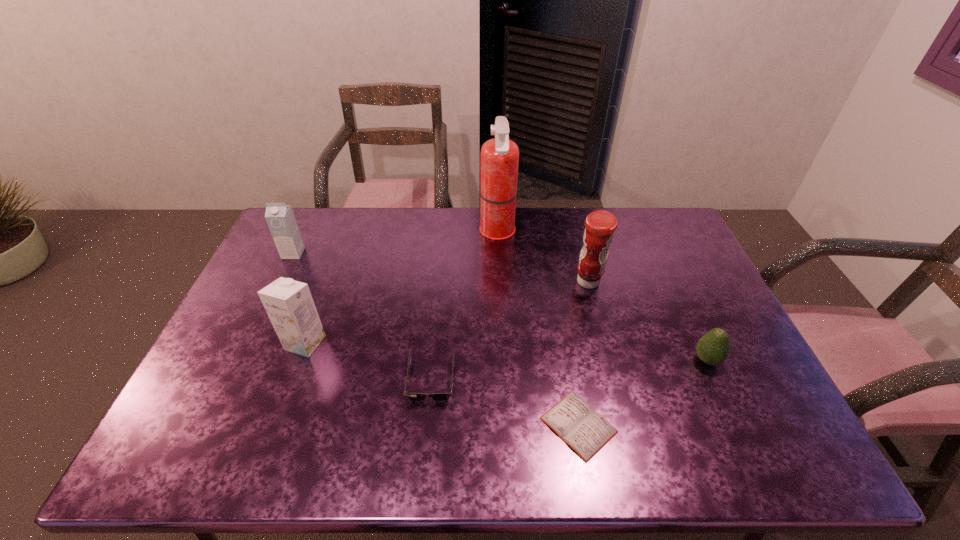
Where is `fire extinguisher`? fire extinguisher is located at coordinates (499, 159).

The height and width of the screenshot is (540, 960). What are the coordinates of `the tallest object` in the screenshot? It's located at (499, 159).

I want to click on the third farthest object, so click(600, 225).

The height and width of the screenshot is (540, 960). Find the location of `the right carton`. the right carton is located at coordinates (289, 304).

Where is `the sixth object from right to left`? Image resolution: width=960 pixels, height=540 pixels. the sixth object from right to left is located at coordinates (289, 304).

This screenshot has width=960, height=540. I want to click on the leftmost object, so click(x=280, y=218).

Find the location of `the farther carton`. the farther carton is located at coordinates (280, 218).

Image resolution: width=960 pixels, height=540 pixels. Find the location of `the rightmost object`. the rightmost object is located at coordinates (713, 348).

Where is `avocado`? The image size is (960, 540). avocado is located at coordinates (713, 348).

At what (x,y) coordinates should I click in order to perform the action: click on the third object from left to right. Please return your answer as a coordinate pair (x, y). The height and width of the screenshot is (540, 960). Looking at the image, I should click on (415, 397).